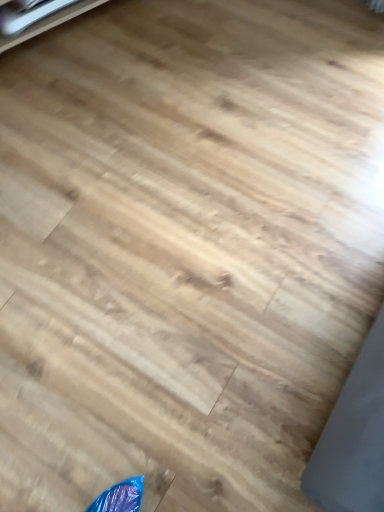
The width and height of the screenshot is (384, 512). What do you see at coordinates (49, 23) in the screenshot?
I see `metallic silver remote control at upper left` at bounding box center [49, 23].

At what (x,y) coordinates should I click in order to perform the action: click on metallic silver remote control at upper left. Please return your answer as a coordinate pair (x, y). Image resolution: width=384 pixels, height=512 pixels. Looking at the image, I should click on pyautogui.click(x=49, y=23).

This screenshot has height=512, width=384. Identify the location of metallic silver remote control at upper left. (49, 23).